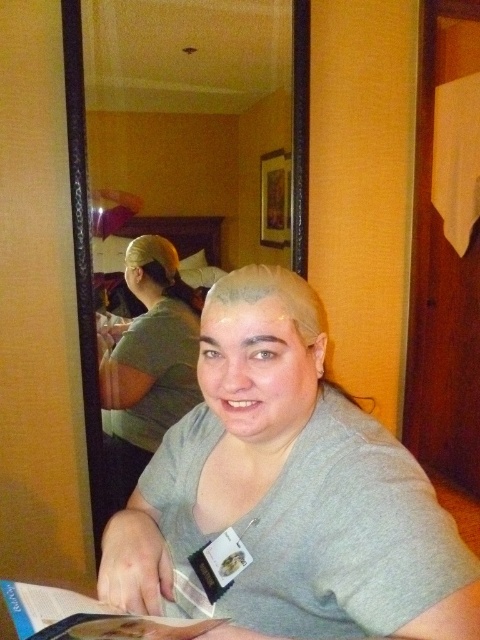
Between gray matte shirt at center and matte paper magazine at lower left, which one is positioned higher?

gray matte shirt at center is above.

In the scene shown: Is gray matte shirt at center positioned before matte paper magazine at lower left?

No.

Is point (383, 484) positioned behind point (62, 604)?

Yes, it is behind point (62, 604).

Identify the location of gray matte shirt at center. The width and height of the screenshot is (480, 640). (289, 490).

Is green matte shirt at center thinner than matte paper magazine at lower left?

Yes, green matte shirt at center is thinner than matte paper magazine at lower left.

Does green matte shirt at center appear on the left side of matte paper magazine at lower left?

Yes, green matte shirt at center is to the left of matte paper magazine at lower left.

Does point (133, 465) come farther from viewer compared to point (68, 634)?

That is True.

The height and width of the screenshot is (640, 480). Find the location of `green matte shirt at center`. green matte shirt at center is located at coordinates (147, 364).

Is gray matte shirt at center in front of green matte shirt at center?

Yes, gray matte shirt at center is in front of green matte shirt at center.

Who is higher up, gray matte shirt at center or green matte shirt at center?

gray matte shirt at center is above.

Is point (250, 266) farther from viewer compared to point (107, 429)?

No, it is in front of (107, 429).

Where is `gray matte shirt at center`? The image size is (480, 640). gray matte shirt at center is located at coordinates (289, 490).